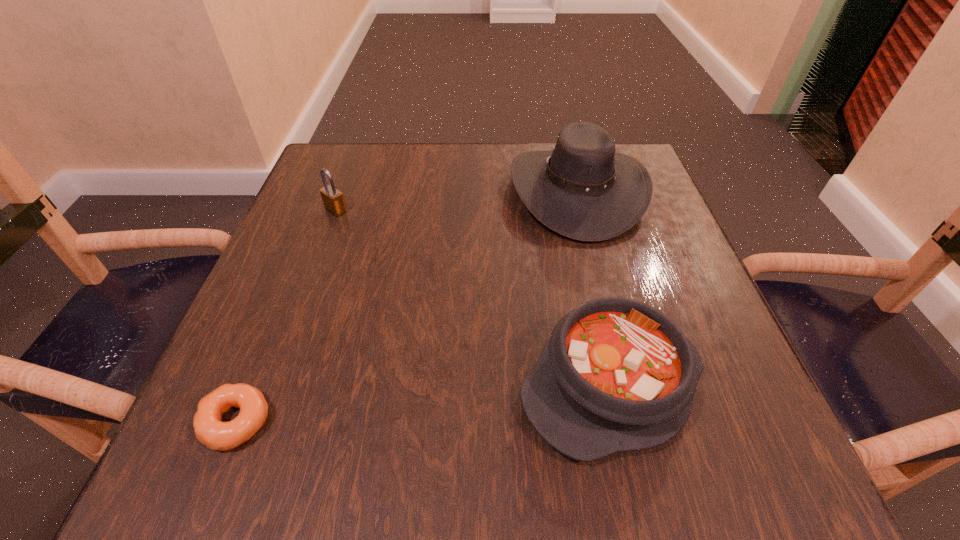
I want to click on vacant space at the far edge, so click(486, 155).

Where is `vacant region at the left edge`? vacant region at the left edge is located at coordinates (274, 324).

In the image, there is a desktop. Where is `vacant space at the right edge`? Image resolution: width=960 pixels, height=540 pixels. vacant space at the right edge is located at coordinates (684, 281).

Locate an element on the screen. This screenshot has width=960, height=540. vacant space at the far left corner of the desktop is located at coordinates (328, 166).

In the image, there is a desktop. In order to click on free space at the near left corner in this screenshot , I will do `click(300, 481)`.

In the image, there is a desktop. Where is `vacant space at the near right corner`? The height and width of the screenshot is (540, 960). vacant space at the near right corner is located at coordinates pyautogui.click(x=771, y=460).

Locate an element on the screen. free space between the shortest object and the padlock is located at coordinates (286, 316).

The height and width of the screenshot is (540, 960). Identify the location of vacant region between the padlock and the casserole. (473, 297).

At what (x,y) coordinates should I click in order to perform the action: click on free space between the doughnut and the tallest object. Please return your answer as a coordinate pair (x, y). Looking at the image, I should click on (407, 307).

The image size is (960, 540). I want to click on free area in between the shortest object and the padlock, so click(286, 316).